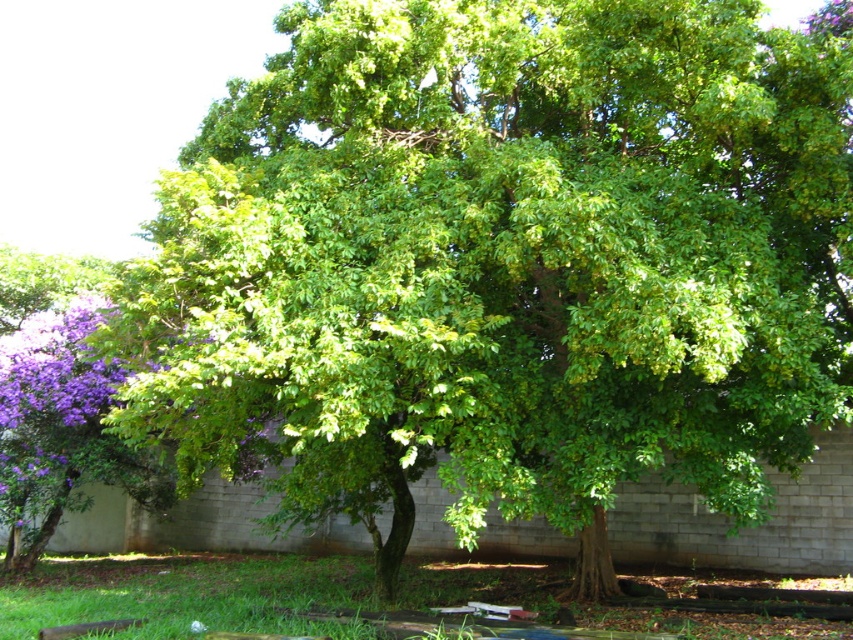
Is point (172, 602) in front of point (44, 365)?

Yes, it is.

Does green grass at lower center appear on the right side of purple matte flower at left?

Correct, you'll find green grass at lower center to the right of purple matte flower at left.

You are a GUI agent. You are given a task and a screenshot of the screen. Output one action in this format:
    pyautogui.click(x=<x>, y=<y>)
    Task: Click on the green grass at lower center
    This screenshot has height=640, width=853.
    Given the screenshot: What is the action you would take?
    pyautogui.click(x=189, y=593)